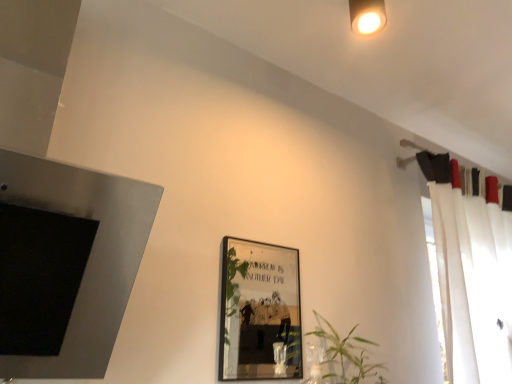
Question: Could green leafy plant at center be considered to be inside metallic silver picture frame at center?

Choices:
 (A) yes
 (B) no

Answer: (B)

Question: Considering the relative sizes of metallic silver picture frame at center and green leafy plant at center in the image provided, is metallic silver picture frame at center taller than green leafy plant at center?

Choices:
 (A) no
 (B) yes

Answer: (B)

Question: Is metallic silver picture frame at center to the right of green leafy plant at center from the viewer's perspective?

Choices:
 (A) no
 (B) yes

Answer: (A)

Question: Does metallic silver picture frame at center have a larger size compared to green leafy plant at center?

Choices:
 (A) yes
 (B) no

Answer: (B)

Question: Does metallic silver picture frame at center appear on the left side of green leafy plant at center?

Choices:
 (A) yes
 (B) no

Answer: (A)

Question: Is metallic silver picture frame at center positioned in front of green leafy plant at center?

Choices:
 (A) yes
 (B) no

Answer: (A)

Question: From a real-world perspective, is green leafy plant at center beneath white sheer curtain at right?

Choices:
 (A) yes
 (B) no

Answer: (A)

Question: Considering the relative sizes of green leafy plant at center and white sheer curtain at right in the image provided, is green leafy plant at center wider than white sheer curtain at right?

Choices:
 (A) no
 (B) yes

Answer: (A)

Question: From the image's perspective, does green leafy plant at center appear lower than white sheer curtain at right?

Choices:
 (A) no
 (B) yes

Answer: (B)

Question: Is green leafy plant at center at the left side of white sheer curtain at right?

Choices:
 (A) no
 (B) yes

Answer: (B)

Question: Does green leafy plant at center have a smaller size compared to white sheer curtain at right?

Choices:
 (A) no
 (B) yes

Answer: (B)

Question: Is green leafy plant at center not within white sheer curtain at right?

Choices:
 (A) no
 (B) yes

Answer: (B)

Question: Is green leafy plant at center positioned before metallic silver picture frame at center?

Choices:
 (A) yes
 (B) no

Answer: (B)